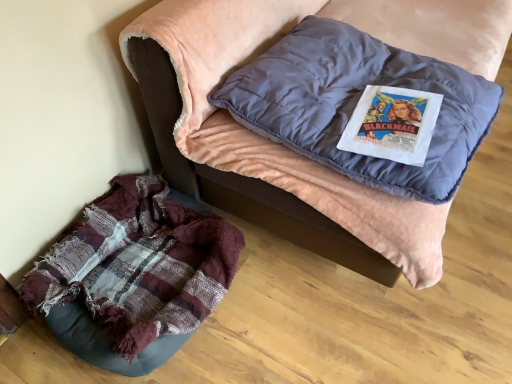
Question: Can you confirm if plaid fabric cushion at lower left is taller than worn fabric bean bag at lower left?

Choices:
 (A) no
 (B) yes

Answer: (B)

Question: Does plaid fabric cushion at lower left have a greater width compared to worn fabric bean bag at lower left?

Choices:
 (A) yes
 (B) no

Answer: (A)

Question: Is worn fabric bean bag at lower left a part of plaid fabric cushion at lower left?

Choices:
 (A) yes
 (B) no

Answer: (B)

Question: Can we say plaid fabric cushion at lower left lies outside worn fabric bean bag at lower left?

Choices:
 (A) no
 (B) yes

Answer: (B)

Question: From the image's perspective, is plaid fabric cushion at lower left beneath worn fabric bean bag at lower left?

Choices:
 (A) no
 (B) yes

Answer: (A)

Question: Considering the relative sizes of plaid fabric cushion at lower left and worn fabric bean bag at lower left in the image provided, is plaid fabric cushion at lower left thinner than worn fabric bean bag at lower left?

Choices:
 (A) yes
 (B) no

Answer: (B)

Question: Is matte blue pillow at upper center at the back of worn fabric bean bag at lower left?

Choices:
 (A) no
 (B) yes

Answer: (A)

Question: Is worn fabric bean bag at lower left at the right side of matte blue pillow at upper center?

Choices:
 (A) no
 (B) yes

Answer: (A)

Question: From the image's perspective, is worn fabric bean bag at lower left under matte blue pillow at upper center?

Choices:
 (A) yes
 (B) no

Answer: (A)

Question: Can you confirm if worn fabric bean bag at lower left is taller than matte blue pillow at upper center?

Choices:
 (A) no
 (B) yes

Answer: (B)

Question: Is worn fabric bean bag at lower left next to matte blue pillow at upper center?

Choices:
 (A) yes
 (B) no

Answer: (B)

Question: Considering the relative sizes of worn fabric bean bag at lower left and matte blue pillow at upper center in the image provided, is worn fabric bean bag at lower left bigger than matte blue pillow at upper center?

Choices:
 (A) no
 (B) yes

Answer: (A)

Question: Can you confirm if plaid fabric cushion at lower left is taller than matte blue pillow at upper center?

Choices:
 (A) yes
 (B) no

Answer: (A)